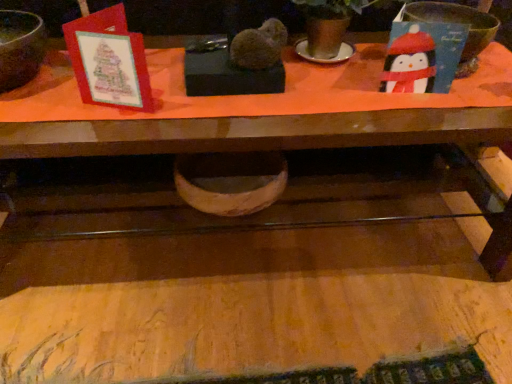
Image resolution: width=512 pixels, height=384 pixels. Describe the element at coordinates (230, 181) in the screenshot. I see `wooden bowl at center, acting as the 1th basin starting from the bottom` at that location.

I want to click on matte black bowl at right, the 1th basin from the top, so click(458, 23).

Measure the distance between matte brown mixing bowl at upper left and camera.

matte brown mixing bowl at upper left is 30.71 inches from camera.

The image size is (512, 384). What do you see at coordinates (275, 371) in the screenshot?
I see `wooden table at lower center` at bounding box center [275, 371].

In order to click on wooden bowl at center, positioned as the second basin in right-to-left order in this screenshot , I will do `click(230, 181)`.

Does point (28, 63) come in front of point (390, 364)?

Yes, it is in front of point (390, 364).

Between matte brown mixing bowl at upper left and wooden table at lower center, which one has larger width?

Wider between the two is matte brown mixing bowl at upper left.

Can you confirm if matte brown mixing bowl at upper left is shorter than wooden table at lower center?

In fact, matte brown mixing bowl at upper left may be taller than wooden table at lower center.

From the picture: Based on their positions, is matte brown mixing bowl at upper left located to the left or right of wooden table at lower center?

matte brown mixing bowl at upper left is to the left of wooden table at lower center.

Is matte black bowl at right, placed as the second basin when sorted from bottom to top, surrounded by matte brown mixing bowl at upper left?

No, matte black bowl at right, placed as the second basin when sorted from bottom to top, is not a part of matte brown mixing bowl at upper left.

In the scene shown: Can you see matte brown mixing bowl at upper left touching matte black bowl at right, placed as the second basin when sorted from bottom to top?

They are not placed beside each other.

From a real-world perspective, which object rests below the other?

In real-world perspective, matte black bowl at right, placed as the second basin when sorted from bottom to top, is lower.

From the image's perspective, which one is positioned lower, matte brown mixing bowl at upper left or matte black bowl at right, which is the 2th basin from left to right?

matte brown mixing bowl at upper left, from the image's perspective.

From the image's perspective, is matte black bowl at right, which is the 2th basin from left to right, located above or below matte brown mixing bowl at upper left?

Clearly, from the image's perspective, matte black bowl at right, which is the 2th basin from left to right, is above matte brown mixing bowl at upper left.

Considering the sizes of objects matte black bowl at right, the 1th basin from the top, and matte brown mixing bowl at upper left in the image provided, who is smaller, matte black bowl at right, the 1th basin from the top, or matte brown mixing bowl at upper left?

With smaller size is matte black bowl at right, the 1th basin from the top.

From a real-world perspective, is matte black bowl at right, which is the 2th basin from left to right, above or below matte brown mixing bowl at upper left?

matte black bowl at right, which is the 2th basin from left to right, is below matte brown mixing bowl at upper left.

Could you tell me if matte black bowl at right, placed as the second basin when sorted from bottom to top, is facing wooden table at lower center?

No.

Does matte black bowl at right, positioned as the 1th basin in right-to-left order, come in front of wooden table at lower center?

No, matte black bowl at right, positioned as the 1th basin in right-to-left order, is further to the viewer.

Are matte black bowl at right, the 1th basin from the top, and wooden table at lower center beside each other?

There is a gap between matte black bowl at right, the 1th basin from the top, and wooden table at lower center.

From a real-world perspective, is matte black bowl at right, positioned as the 1th basin in right-to-left order, below wooden table at lower center?

No, from a real-world perspective, matte black bowl at right, positioned as the 1th basin in right-to-left order, is not below wooden table at lower center.

Is matte black bowl at right, placed as the second basin when sorted from bottom to top, positioned with its back to wooden bowl at center, positioned as the first basin in left-to-right order?

matte black bowl at right, placed as the second basin when sorted from bottom to top, does not have its back to wooden bowl at center, positioned as the first basin in left-to-right order.

Does point (472, 46) come behind point (234, 165)?

No, it is not.

From the image's perspective, is matte black bowl at right, the 1th basin from the top, located above or below wooden bowl at center, positioned as the first basin in left-to-right order?

From the image's perspective, matte black bowl at right, the 1th basin from the top, appears above wooden bowl at center, positioned as the first basin in left-to-right order.

From a real-world perspective, is matte black bowl at right, positioned as the 1th basin in right-to-left order, on top of wooden bowl at center, marked as the 2th basin in a top-to-bottom arrangement?

Indeed, from a real-world perspective, matte black bowl at right, positioned as the 1th basin in right-to-left order, stands above wooden bowl at center, marked as the 2th basin in a top-to-bottom arrangement.

Find the location of `basin below the matte brown mixing bowl at upper left (from the image's perspective)`. basin below the matte brown mixing bowl at upper left (from the image's perspective) is located at coordinates (230, 181).

Can we say wooden bowl at center, positioned as the first basin in left-to-right order, lies outside matte brown mixing bowl at upper left?

That's correct, wooden bowl at center, positioned as the first basin in left-to-right order, is outside of matte brown mixing bowl at upper left.

Consider the image. Which object is thinner, wooden bowl at center, positioned as the second basin in right-to-left order, or matte brown mixing bowl at upper left?

matte brown mixing bowl at upper left is thinner.

From the image's perspective, is wooden bowl at center, positioned as the first basin in left-to-right order, located beneath matte brown mixing bowl at upper left?

Indeed, from the image's perspective, wooden bowl at center, positioned as the first basin in left-to-right order, is shown beneath matte brown mixing bowl at upper left.

Which object is further away from the camera taking this photo, wooden bowl at center, positioned as the first basin in left-to-right order, or matte black bowl at right, placed as the second basin when sorted from bottom to top?

wooden bowl at center, positioned as the first basin in left-to-right order, is behind.

Is wooden bowl at center, positioned as the second basin in right-to-left order, facing towards matte black bowl at right, the 1th basin from the top?

No.

Which of these two, wooden bowl at center, marked as the 2th basin in a top-to-bottom arrangement, or matte black bowl at right, which is the 2th basin from left to right, is smaller?

With smaller size is matte black bowl at right, which is the 2th basin from left to right.

You are a GUI agent. You are given a task and a screenshot of the screen. Output one action in this format:
    pyautogui.click(x=<x>, y=<y>)
    Task: Click on the mixing bowl lying in front of the wooden table at lower center
    This screenshot has width=512, height=384.
    Given the screenshot: What is the action you would take?
    pyautogui.click(x=20, y=47)

This screenshot has height=384, width=512. In order to click on mixing bowl that appears below the matte black bowl at right, which is the 2th basin from left to right (from the image's perspective) in this screenshot , I will do `click(20, 47)`.

Looking at the image, which one is located further to wooden table at lower center, matte black bowl at right, positioned as the 1th basin in right-to-left order, or matte brown mixing bowl at upper left?

matte black bowl at right, positioned as the 1th basin in right-to-left order, is positioned further to the anchor wooden table at lower center.

Based on their spatial positions, is matte brown mixing bowl at upper left or wooden table at lower center closer to matte black bowl at right, the 1th basin from the top?

wooden table at lower center is closer to matte black bowl at right, the 1th basin from the top.

Considering their positions, is wooden bowl at center, positioned as the first basin in left-to-right order, positioned closer to wooden table at lower center than matte black bowl at right, which is the 2th basin from left to right?

wooden bowl at center, positioned as the first basin in left-to-right order, is closer to wooden table at lower center.

Considering their positions, is wooden bowl at center, marked as the 2th basin in a top-to-bottom arrangement, positioned further to matte brown mixing bowl at upper left than matte black bowl at right, the 1th basin from the top?

The object further to matte brown mixing bowl at upper left is matte black bowl at right, the 1th basin from the top.

Based on their spatial positions, is matte brown mixing bowl at upper left or matte black bowl at right, which is the 2th basin from left to right, closer to wooden table at lower center?

Among the two, matte brown mixing bowl at upper left is located nearer to wooden table at lower center.

Considering their positions, is matte black bowl at right, positioned as the 1th basin in right-to-left order, positioned closer to wooden bowl at center, acting as the 1th basin starting from the bottom, than wooden table at lower center?

wooden table at lower center.

From the picture: From the image, which object appears to be farther from matte brown mixing bowl at upper left, wooden bowl at center, positioned as the second basin in right-to-left order, or wooden table at lower center?

The object further to matte brown mixing bowl at upper left is wooden table at lower center.

Looking at the image, which one is located further to matte black bowl at right, placed as the second basin when sorted from bottom to top, matte brown mixing bowl at upper left or wooden bowl at center, acting as the 1th basin starting from the bottom?

Based on the image, matte brown mixing bowl at upper left appears to be further to matte black bowl at right, placed as the second basin when sorted from bottom to top.

Where is `writing between matte brown mixing bowl at upper left and matte black bowl at right, which is the 2th basin from left to right`? writing between matte brown mixing bowl at upper left and matte black bowl at right, which is the 2th basin from left to right is located at coordinates (275, 371).

This screenshot has width=512, height=384. What are the coordinates of `basin between matte brown mixing bowl at upper left and matte black bowl at right, the 1th basin from the top, from left to right` in the screenshot? It's located at (230, 181).

Where is `basin that lies between matte black bowl at right, positioned as the 1th basin in right-to-left order, and wooden table at lower center from top to bottom`? This screenshot has width=512, height=384. basin that lies between matte black bowl at right, positioned as the 1th basin in right-to-left order, and wooden table at lower center from top to bottom is located at coordinates (230, 181).

Locate an element on the screen. basin between matte brown mixing bowl at upper left and wooden table at lower center in the vertical direction is located at coordinates pyautogui.click(x=230, y=181).